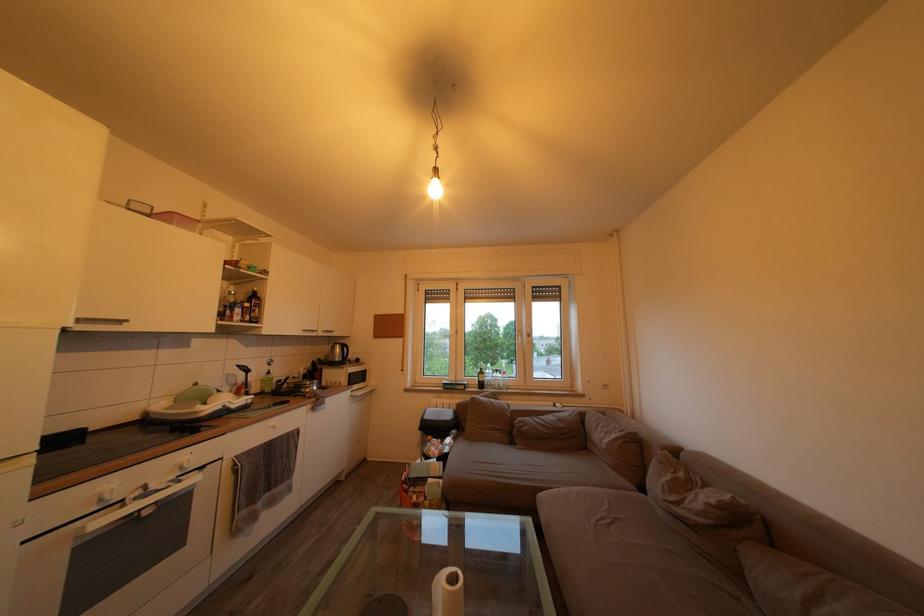
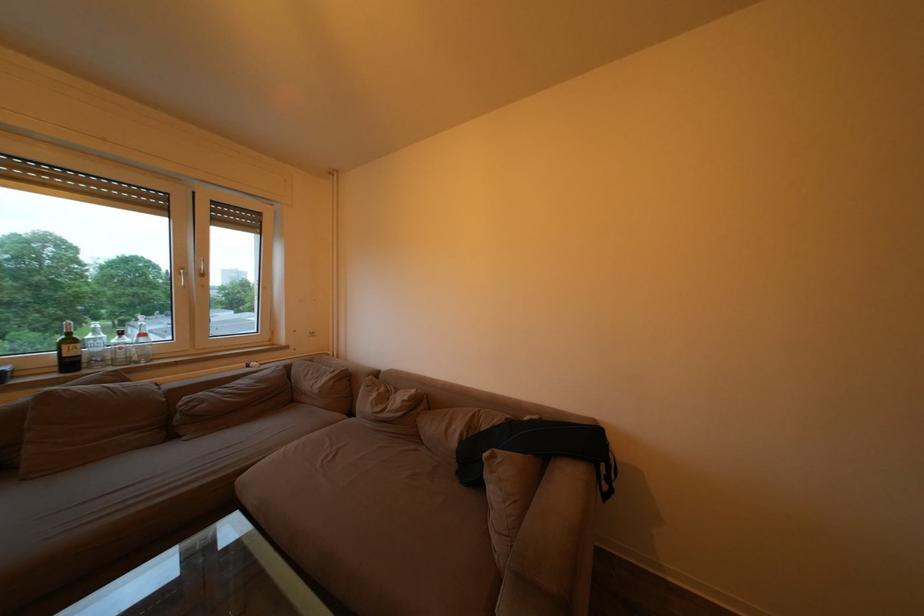
In the second image, find the point that corresponds to the point at 512,379 in the first image.

(151, 341)